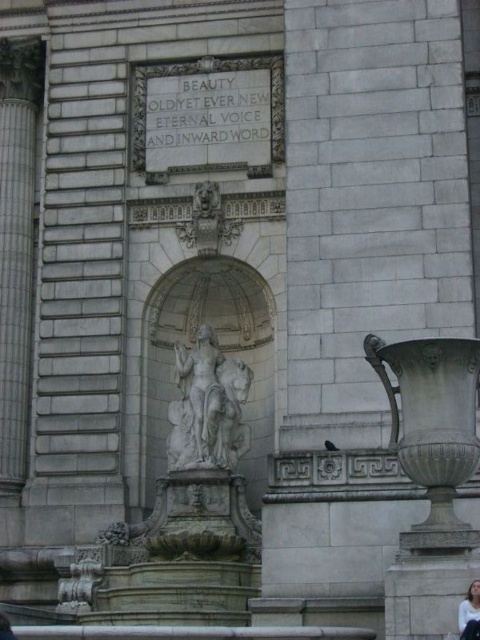
From the picture: Does white marble statue at center have a lesser height compared to white fabric at lower right?

Indeed, white marble statue at center has a lesser height compared to white fabric at lower right.

Between white marble statue at center and white fabric at lower right, which one is positioned lower?

white fabric at lower right

Does point (191, 452) come in front of point (478, 593)?

That is False.

You are a GUI agent. You are given a task and a screenshot of the screen. Output one action in this format:
    pyautogui.click(x=<x>, y=<y>)
    Task: Click on the white marble statue at center
    
    Given the screenshot: What is the action you would take?
    pyautogui.click(x=207, y=406)